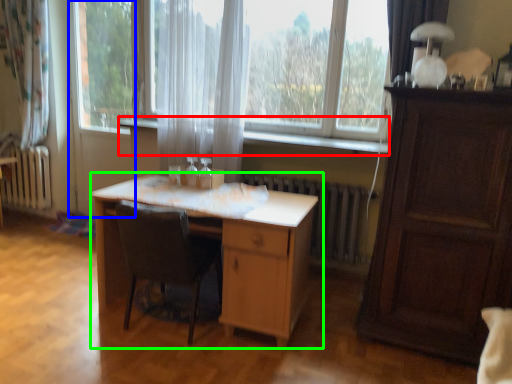
Question: Estimate the real-world distances between objects in this image. Which object is closer to window sill (highlighted by a red box), screen door (highlighted by a blue box) or table (highlighted by a green box)?

Choices:
 (A) screen door
 (B) table

Answer: (B)